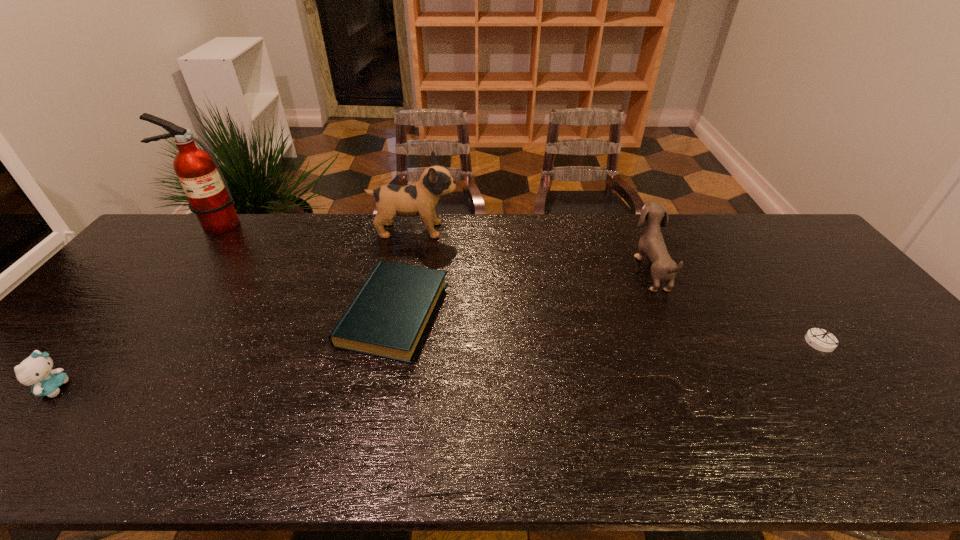
This screenshot has width=960, height=540. Find the location of `the tallest object`. the tallest object is located at coordinates (209, 197).

The image size is (960, 540). I want to click on the fifth shortest object, so click(x=421, y=198).

Find the location of a particular element. the taller puppy is located at coordinates (421, 198).

I want to click on the shorter puppy, so click(x=651, y=243).

Find the location of a particular element. the right puppy is located at coordinates (651, 243).

Where is `the third shortest object`? the third shortest object is located at coordinates (36, 370).

This screenshot has height=540, width=960. In order to click on the nearest object in this screenshot , I will do `click(36, 370)`.

Identify the location of book. The image size is (960, 540). (389, 316).

Identify the location of the rightmost object. Image resolution: width=960 pixels, height=540 pixels. (822, 340).

I want to click on vacant region located on the nozzle and handle of the fire extinguisher, so (x=161, y=289).